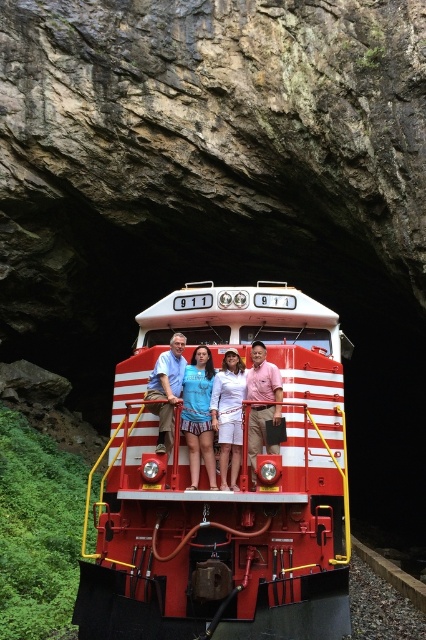
Is point (192, 600) farther from viewer compared to point (181, 378)?

No, it is not.

Does shiny red train at center appear under matte white shirt at center?

Yes, shiny red train at center is below matte white shirt at center.

Is point (181, 499) positioned before point (175, 401)?

Yes, it is.

Locate an element on the screen. Image resolution: width=426 pixels, height=640 pixels. shiny red train at center is located at coordinates (224, 484).

Does shiny red train at center have a smaller size compared to white matte shorts at center?

Indeed, shiny red train at center has a smaller size compared to white matte shorts at center.

Does shiny red train at center have a greater width compared to white matte shorts at center?

Yes.

You are a GUI agent. You are given a task and a screenshot of the screen. Output one action in this format:
    pyautogui.click(x=<x>, y=<y>)
    Task: Click on the shiny red train at center
    This screenshot has height=640, width=426.
    Given the screenshot: What is the action you would take?
    [x=224, y=484]

Locate an element on the screen. The width and height of the screenshot is (426, 640). matte blue shorts at center is located at coordinates (198, 416).

Is matte blue shorts at center thinner than matte white shirt at center?

Yes.

Who is more forward, (195, 392) or (180, 348)?

Point (195, 392) is in front.

The image size is (426, 640). I want to click on matte blue shorts at center, so click(198, 416).